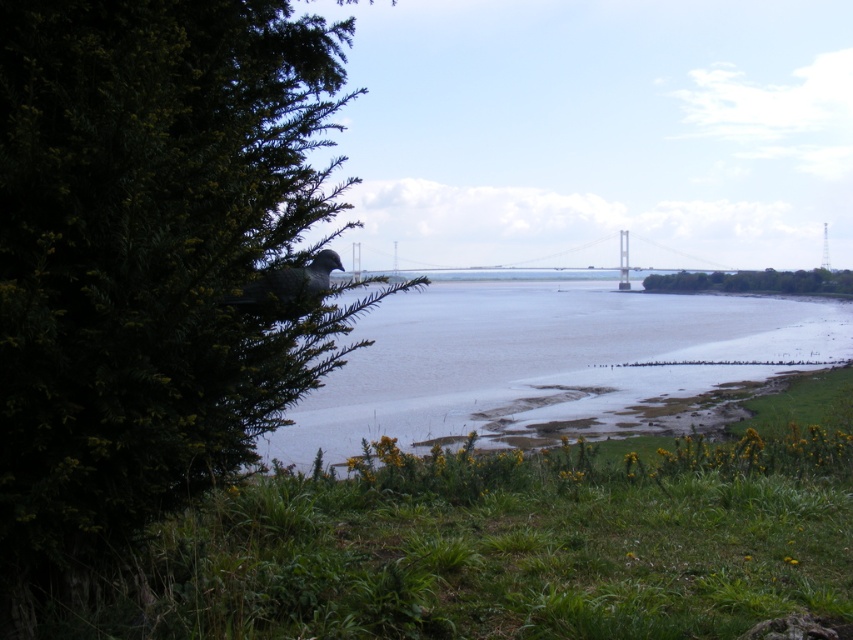
Question: Which of the following is the farthest from the observer?

Choices:
 (A) white concrete bridge at center
 (B) gray concrete waterway at center
 (C) green leafy tree at lower right
 (D) green leafy tree at left

Answer: (C)

Question: Does gray concrete waterway at center appear under green leafy tree at lower right?

Choices:
 (A) no
 (B) yes

Answer: (B)

Question: From the image, what is the correct spatial relationship of green leafy tree at left in relation to white concrete bridge at center?

Choices:
 (A) left
 (B) right

Answer: (A)

Question: Among these objects, which one is farthest from the camera?

Choices:
 (A) gray concrete waterway at center
 (B) white concrete bridge at center
 (C) green leafy tree at left

Answer: (B)

Question: Among these points, which one is farthest from the camera?

Choices:
 (A) (439, 332)
 (B) (809, 280)
 (C) (457, 275)

Answer: (C)

Question: Is gray concrete waterway at center to the left of white concrete bridge at center from the viewer's perspective?

Choices:
 (A) yes
 (B) no

Answer: (A)